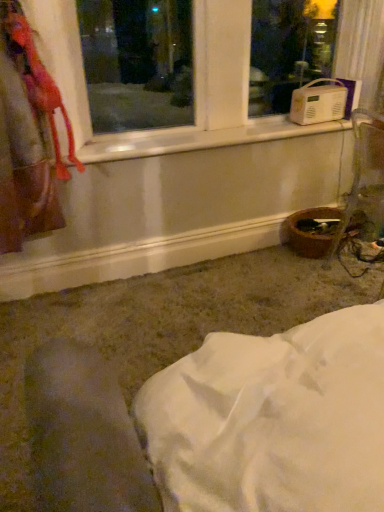
Where is `vacant space underneath white plastic radio at upper right (from a real-world perspective)`? vacant space underneath white plastic radio at upper right (from a real-world perspective) is located at coordinates (201, 136).